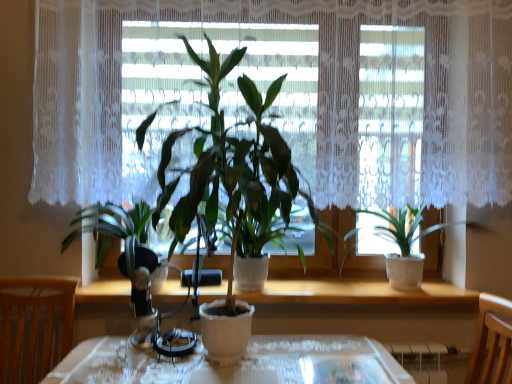
Locate an element on the screen. Image resolution: width=512 pixels, height=384 pixels. green matte plant at center, which is the 2th houseplant from left to right is located at coordinates [x=232, y=190].

What is the approximate width of wooden chair at left?

21.16 inches.

This screenshot has width=512, height=384. Describe the element at coordinates (318, 99) in the screenshot. I see `white lace curtain at center` at that location.

Identify the location of wooden at center. The height and width of the screenshot is (384, 512). (357, 293).

Identify the location of green matte plant at right, positioned as the first houseplant in right-to-left order. (409, 244).

The width and height of the screenshot is (512, 384). In order to click on green matte plant at center, placed as the 2th houseplant when sorted from right to left in this screenshot , I will do `click(232, 190)`.

Between point (133, 217) and point (286, 190), which one is positioned in front?

Point (286, 190)

Is green matte plant at left, which ranks as the first houseplant in left-to-right order, placed right next to green matte plant at center, which is the 2th houseplant from left to right?

green matte plant at left, which ranks as the first houseplant in left-to-right order, is not next to green matte plant at center, which is the 2th houseplant from left to right, and they're not touching.

You are a GUI agent. You are given a task and a screenshot of the screen. Output one action in this format:
    pyautogui.click(x=<x>, y=<y>)
    Task: Click on the 1st houseplant behind when counting from the green matte plant at center, placed as the 2th houseplant when sorted from right to left
    
    Given the screenshot: What is the action you would take?
    pyautogui.click(x=124, y=245)

Is green matte plant at left, which ranks as the first houseplant in left-to-right order, wider or thinner than green matte plant at center, which is the 2th houseplant from left to right?

green matte plant at left, which ranks as the first houseplant in left-to-right order, is wider than green matte plant at center, which is the 2th houseplant from left to right.

Between point (52, 306) and point (449, 285), which one is positioned behind?

The point (449, 285) is behind.

From the image's perspective, which one is positioned higher, wooden chair at left or wooden at center?

wooden at center is shown above in the image.

Is wooden chair at left bigger than wooden at center?

Yes.

Locate an element on the screen. The image size is (512, 384). chair on the left of wooden at center is located at coordinates (34, 325).

From the image's perspective, which is above, green matte plant at right, placed as the third houseplant when sorted from left to right, or green matte plant at center, which is the 2th houseplant from left to right?

green matte plant at center, which is the 2th houseplant from left to right, appears higher in the image.

Considering the positions of objects green matte plant at right, positioned as the first houseplant in right-to-left order, and green matte plant at center, which is the 2th houseplant from left to right, in the image provided, who is in front, green matte plant at right, positioned as the first houseplant in right-to-left order, or green matte plant at center, which is the 2th houseplant from left to right,?

green matte plant at center, which is the 2th houseplant from left to right.

Would you say green matte plant at right, positioned as the first houseplant in right-to-left order, is inside or outside green matte plant at center, which is the 2th houseplant from left to right?

The correct answer is: outside.

Is point (256, 90) positioned in front of point (444, 68)?

That is True.

Is green matte plant at center, placed as the 2th houseplant when sorted from right to left, facing towards white lace curtain at center?

No, green matte plant at center, placed as the 2th houseplant when sorted from right to left, is not oriented towards white lace curtain at center.

How many degrees apart are the facing directions of green matte plant at center, placed as the 2th houseplant when sorted from right to left, and white lace curtain at center?

The angular difference between green matte plant at center, placed as the 2th houseplant when sorted from right to left, and white lace curtain at center is 3.69 degrees.

Can you confirm if white lace curtain at center is thinner than wooden chair at left?

Correct, the width of white lace curtain at center is less than that of wooden chair at left.

From a real-world perspective, who is located higher, white lace curtain at center or wooden chair at left?

In real-world perspective, white lace curtain at center is above.

Does white lace curtain at center appear on the left side of wooden chair at left?

In fact, white lace curtain at center is to the right of wooden chair at left.

Who is bigger, wooden at center or green matte plant at left, which is the third houseplant from right to left?

With larger size is green matte plant at left, which is the third houseplant from right to left.

Between wooden at center and green matte plant at left, which ranks as the first houseplant in left-to-right order, which one has more height?

green matte plant at left, which ranks as the first houseplant in left-to-right order, is taller.

Which is in front, wooden at center or green matte plant at left, which ranks as the first houseplant in left-to-right order?

green matte plant at left, which ranks as the first houseplant in left-to-right order, is in front.

Can you confirm if wooden at center is thinner than green matte plant at left, which ranks as the first houseplant in left-to-right order?

Indeed, wooden at center has a lesser width compared to green matte plant at left, which ranks as the first houseplant in left-to-right order.

Considering the sizes of wooden chair at left and green matte plant at left, which is the third houseplant from right to left, in the image, is wooden chair at left taller or shorter than green matte plant at left, which is the third houseplant from right to left,?

wooden chair at left is taller than green matte plant at left, which is the third houseplant from right to left.

Is green matte plant at left, which ranks as the first houseplant in left-to-right order, at the back of wooden chair at left?

No, green matte plant at left, which ranks as the first houseplant in left-to-right order, is not at the back of wooden chair at left.

This screenshot has height=384, width=512. Find the location of `houseplant that appears in front of the green matte plant at left, which ranks as the first houseplant in left-to-right order`. houseplant that appears in front of the green matte plant at left, which ranks as the first houseplant in left-to-right order is located at coordinates (232, 190).

Locate an element on the screen. Image resolution: width=512 pixels, height=384 pixels. chair that is on the left side of wooden at center is located at coordinates (34, 325).

Which object lies nearer to the anchor point wooden chair at left, white lace curtain at center or green matte plant at right, positioned as the first houseplant in right-to-left order?

white lace curtain at center is positioned closer to the anchor wooden chair at left.

Looking at the image, which one is located closer to white lace curtain at center, wooden at center or green matte plant at right, placed as the third houseplant when sorted from left to right?

green matte plant at right, placed as the third houseplant when sorted from left to right.

Looking at the image, which one is located further to white lace curtain at center, green matte plant at left, which is the third houseplant from right to left, or green matte plant at center, placed as the 2th houseplant when sorted from right to left?

green matte plant at left, which is the third houseplant from right to left, lies further to white lace curtain at center than the other object.

Looking at the image, which one is located closer to wooden chair at left, white lace curtain at center or green matte plant at left, which is the third houseplant from right to left?

green matte plant at left, which is the third houseplant from right to left.

From the image, which object appears to be farther from white lace curtain at center, green matte plant at center, which is the 2th houseplant from left to right, or wooden at center?

The object further to white lace curtain at center is wooden at center.

Consider the image. Considering their positions, is green matte plant at left, which is the third houseplant from right to left, positioned further to green matte plant at center, placed as the 2th houseplant when sorted from right to left, than wooden at center?

Among the two, wooden at center is located further to green matte plant at center, placed as the 2th houseplant when sorted from right to left.

Looking at the image, which one is located closer to green matte plant at right, positioned as the first houseplant in right-to-left order, green matte plant at center, placed as the 2th houseplant when sorted from right to left, or white lace curtain at center?

white lace curtain at center lies closer to green matte plant at right, positioned as the first houseplant in right-to-left order, than the other object.

When comparing their distances from white lace curtain at center, does wooden at center or green matte plant at center, placed as the 2th houseplant when sorted from right to left, seem further?

wooden at center.

Find the location of a particular element. curtain between green matte plant at center, which is the 2th houseplant from left to right, and green matte plant at right, placed as the third houseplant when sorted from left to right, in the horizontal direction is located at coordinates (318, 99).

You are a GUI agent. You are given a task and a screenshot of the screen. Output one action in this format:
    pyautogui.click(x=<x>, y=<y>)
    Task: Click on the window sill situated between wooden chair at left and green matte plant at right, positioned as the first houseplant in right-to-left order, from left to right
    Image resolution: width=512 pixels, height=384 pixels.
    Given the screenshot: What is the action you would take?
    click(357, 293)

Image resolution: width=512 pixels, height=384 pixels. Identify the location of curtain between green matte plant at left, which is the third houseplant from right to left, and green matte plant at right, positioned as the first houseplant in right-to-left order. (318, 99).

What are the coordinates of `houseplant situated between green matte plant at left, which ranks as the first houseplant in left-to-right order, and green matte plant at right, placed as the third houseplant when sorted from left to right, from left to right` in the screenshot? It's located at (232, 190).